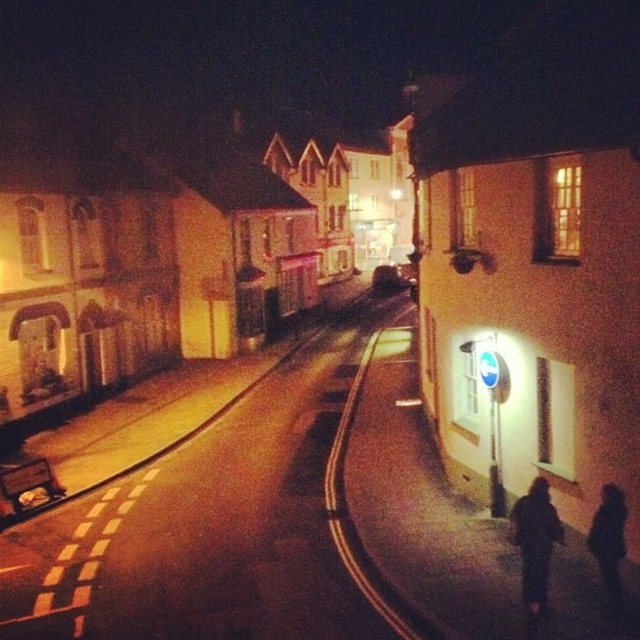
You are a delivery person with a 5 meter long truck. You need to park your truck on the black asphalt road at center near the black matte figure at lower right. Can your truck fit between them without overlapping?

The distance between the black asphalt road at center and the black matte figure at lower right is 4.95 meters. Since your truck is 5 meters long, it will not fit between them without overlapping.

You are a pedestrian standing on the black asphalt road at center and want to reach the dark fabric jacket at lower right. Which direction should you walk to get closer to the jacket?

The dark fabric jacket at lower right is positioned above the black asphalt road at center, so you should walk upward to reach it.